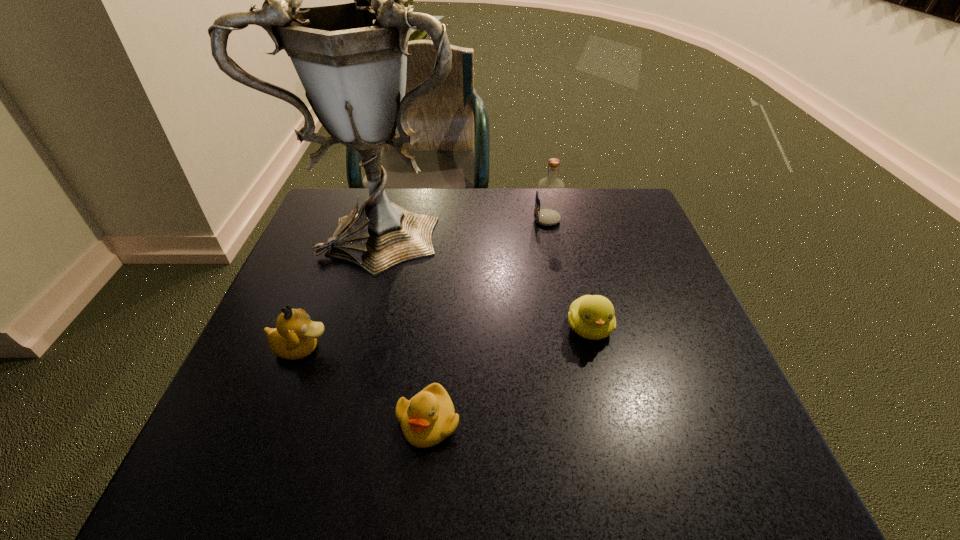
Find the location of `the tallest object`. the tallest object is located at coordinates point(351,58).

Identify the location of vodka. (550, 190).

Identify the location of the leftmost duckling. This screenshot has height=540, width=960. (295, 337).

Where is `the rightmost duckling`? The image size is (960, 540). the rightmost duckling is located at coordinates 591,316.

This screenshot has height=540, width=960. What are the coordinates of `the second tallest duckling` in the screenshot? It's located at (591, 316).

Find the location of a particular element. The height and width of the screenshot is (540, 960). the second duckling from right to left is located at coordinates pos(429,417).

Find the location of `the nearest object`. the nearest object is located at coordinates (429, 417).

Locate an element on the screen. The image size is (960, 540). blank space located on the right of the trophy cup is located at coordinates (511, 227).

This screenshot has width=960, height=540. What are the coordinates of `free point located on the label of the second tallest object` in the screenshot? It's located at (402, 220).

Locate an element on the screen. free space located on the label of the second tallest object is located at coordinates (516, 220).